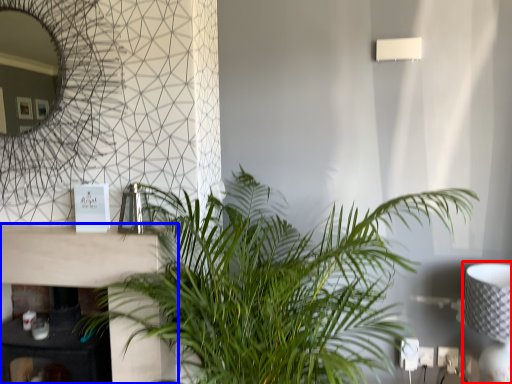
Question: Which object is further to the camera taking this photo, table lamp (highlighted by a red box) or table (highlighted by a blue box)?

Choices:
 (A) table lamp
 (B) table

Answer: (B)